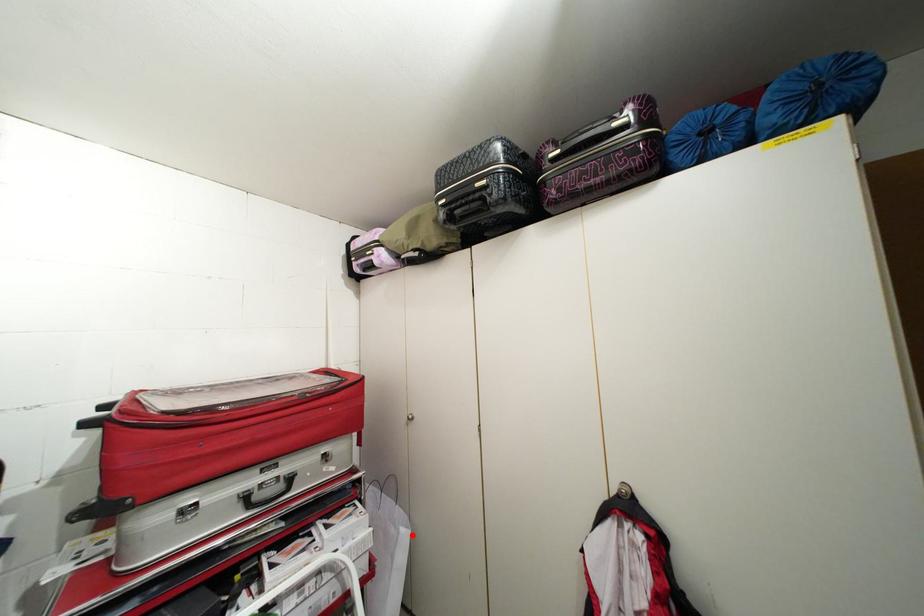
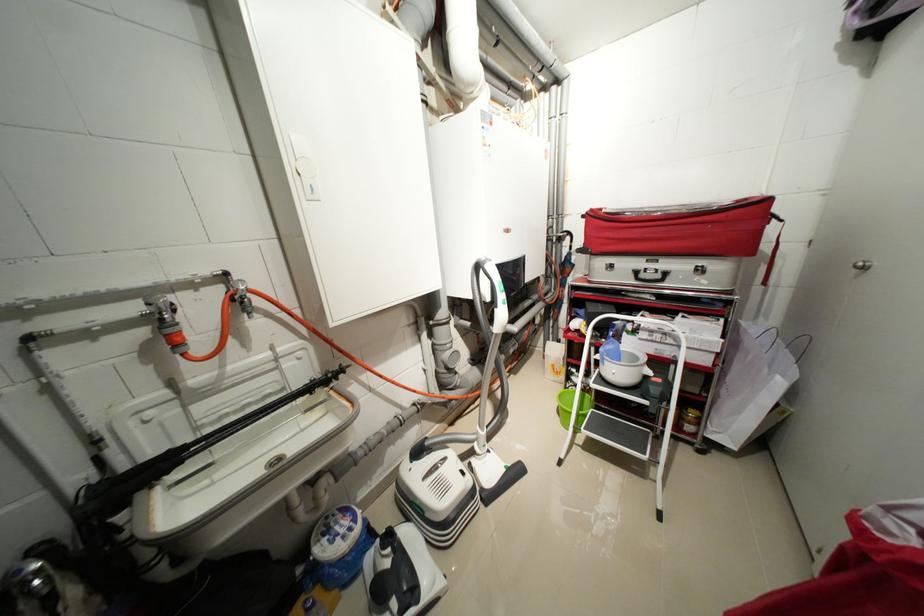
Where in the second image is the point corresponding to the highlighted location from the first image?

(787, 384)